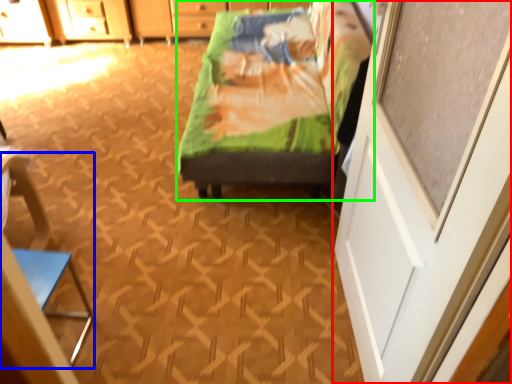
Question: Which object is positioned closest to screen door (highlighted by a red box)? Select from armchair (highlighted by a blue box) and furniture (highlighted by a green box).

Choices:
 (A) armchair
 (B) furniture

Answer: (B)